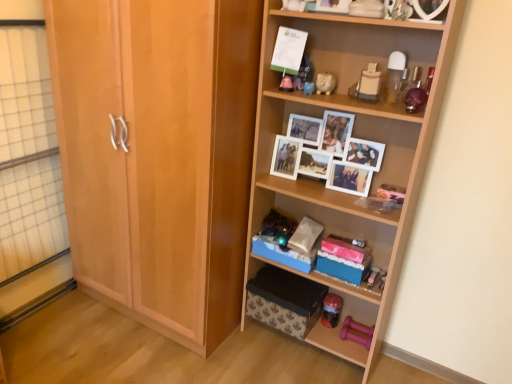
Find the location of a particular element. This screenshot has height=384, width=512. free area below transparent glass door at left (from a real-world perspective) is located at coordinates (42, 311).